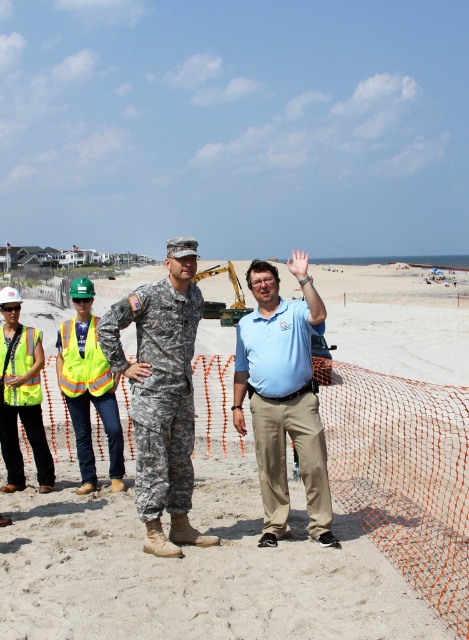
Question: Which object is positioned farthest from the sandy beach at center?

Choices:
 (A) orange mesh net at lower right
 (B) reflective yellow vest at left

Answer: (A)

Question: Is sandy beach at center further to the viewer compared to orange mesh net at lower right?

Choices:
 (A) yes
 (B) no

Answer: (B)

Question: Considering the relative positions of light blue shirt at center and neon yellow reflective vest at left in the image provided, where is light blue shirt at center located with respect to neon yellow reflective vest at left?

Choices:
 (A) below
 (B) above

Answer: (B)

Question: Estimate the real-world distances between objects in this image. Which object is farther from the light blue shirt at center?

Choices:
 (A) neon yellow reflective vest at left
 (B) orange mesh net at lower right
 (C) camouflage fabric uniform at center
 (D) reflective yellow safety vest at left

Answer: (B)

Question: Does sandy beach at center have a smaller size compared to light blue shirt at center?

Choices:
 (A) yes
 (B) no

Answer: (B)

Question: Which of the following is the farthest from the observer?

Choices:
 (A) (325, 385)
 (B) (74, 392)
 (C) (103, 406)
 (D) (264, 484)

Answer: (A)